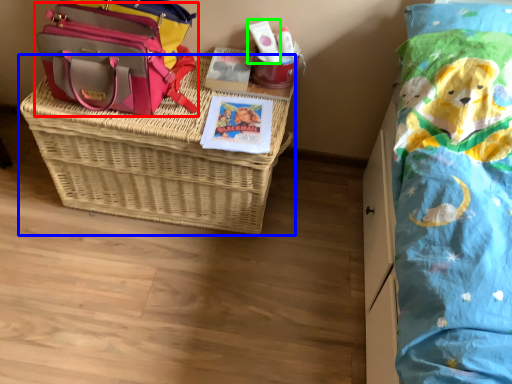
Question: Which object is positioned farthest from shoulder bag (highlighted by a red box)? Select from picnic basket (highlighted by a blue box) and toiletry (highlighted by a green box).

Choices:
 (A) picnic basket
 (B) toiletry

Answer: (B)